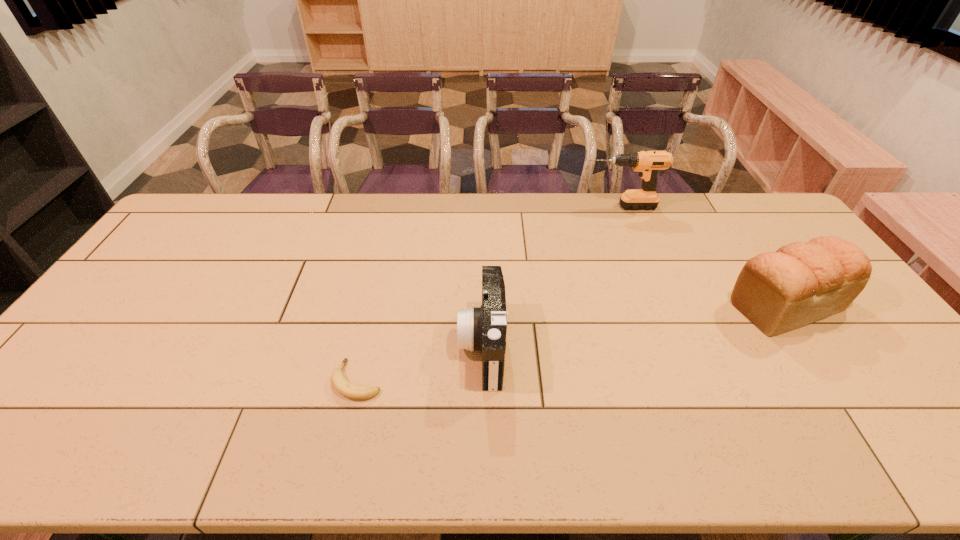
Find the location of a particular element. free region located 0.070m on the back of the rightmost object is located at coordinates (756, 259).

At what (x,y) coordinates should I click in order to perform the action: click on free region located 0.350m on the lens of the third object from right to left. Please return your answer as a coordinate pair (x, y). This screenshot has width=960, height=540. Looking at the image, I should click on (326, 346).

Identify the location of vacant space located on the lens of the third object from right to left. (338, 346).

Image resolution: width=960 pixels, height=540 pixels. What are the coordinates of `free spot located on the lens of the third object from right to left` in the screenshot? It's located at (402, 346).

The image size is (960, 540). In order to click on vacant region located on the left of the shortest object in this screenshot , I will do `click(232, 380)`.

Where is `object located in the far edge section of the desktop`? This screenshot has width=960, height=540. object located in the far edge section of the desktop is located at coordinates (648, 163).

Find the location of a particular element. The image size is (960, 540). object situated at the right edge is located at coordinates (802, 282).

This screenshot has width=960, height=540. Identify the location of vacant space at the far edge of the desktop. (246, 213).

This screenshot has width=960, height=540. I want to click on vacant space at the near edge of the desktop, so point(389,453).

You are a GUI agent. You are given a task and a screenshot of the screen. Output one action in this format:
    pyautogui.click(x=<x>, y=<y>)
    Task: Click on the free space at the near left corner
    This screenshot has height=540, width=960.
    Given the screenshot: What is the action you would take?
    pyautogui.click(x=36, y=451)